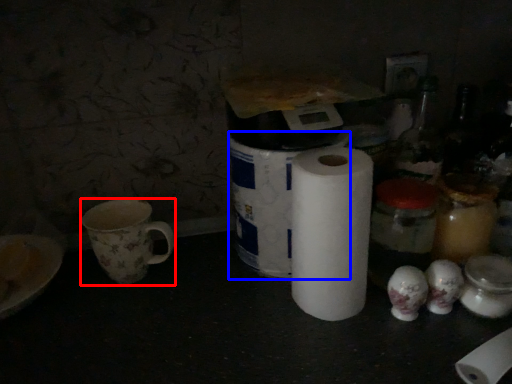
Question: Which object is closer to the camera taking this photo, coffee cup (highlighted by a red box) or toilet paper (highlighted by a blue box)?

Choices:
 (A) coffee cup
 (B) toilet paper

Answer: (B)